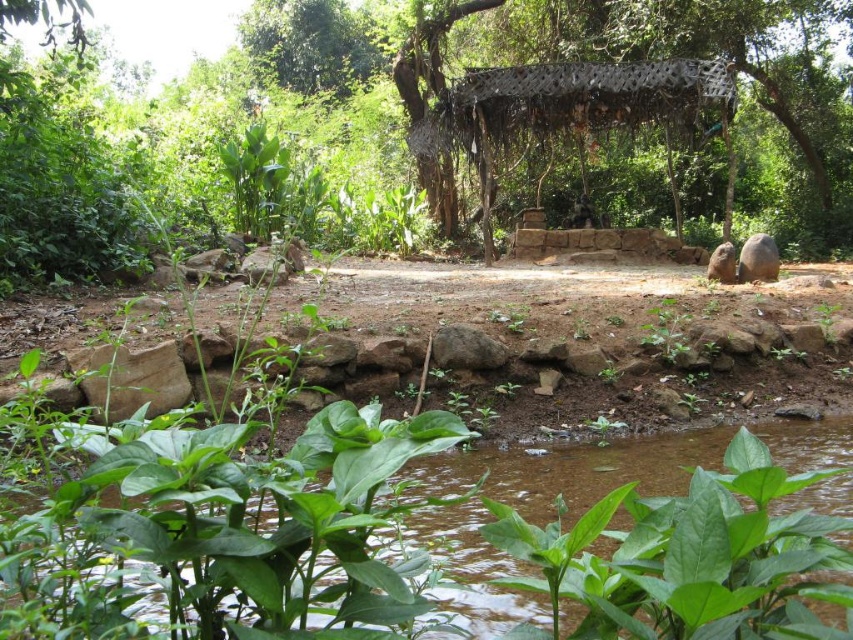
Question: Among these points, which one is farthest from the camera?

Choices:
 (A) (844, 106)
 (B) (556, 618)

Answer: (A)

Question: Is green leafy water at bottom bigger than rusty metal canopy at center?

Choices:
 (A) yes
 (B) no

Answer: (B)

Question: Which point appears farthest from the camera in this image?

Choices:
 (A) (120, 616)
 (B) (434, 172)

Answer: (B)

Question: Is green leafy water at bottom below rusty metal canopy at center?

Choices:
 (A) yes
 (B) no

Answer: (A)

Question: Is green leafy water at bottom thinner than rusty metal canopy at center?

Choices:
 (A) yes
 (B) no

Answer: (A)